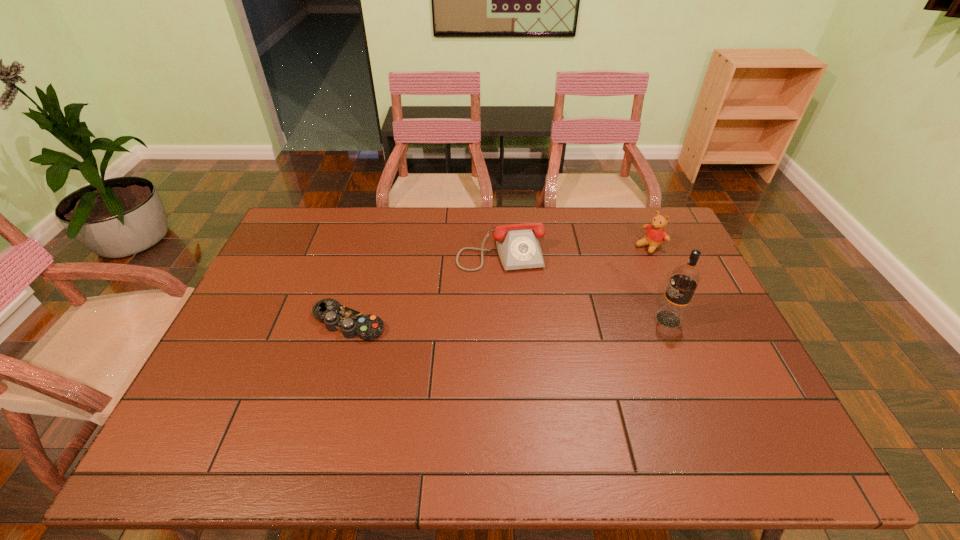
Where is `unoccupied position between the telephone and the third shortest object`? unoccupied position between the telephone and the third shortest object is located at coordinates (575, 247).

This screenshot has width=960, height=540. Find the location of `free space between the tallest object and the third shortest object`. free space between the tallest object and the third shortest object is located at coordinates (659, 282).

Identify the location of vacant space that's between the leftmost object and the third shortest object. This screenshot has height=540, width=960. (499, 284).

This screenshot has width=960, height=540. Identify the location of unoccupied position between the leftmost object and the third shortest object. (499, 284).

You are a GUI agent. You are given a task and a screenshot of the screen. Output one action in this format:
    pyautogui.click(x=<x>, y=<y>)
    Task: Click on the vacant area that lies between the control and the third shortest object
    
    Given the screenshot: What is the action you would take?
    pyautogui.click(x=499, y=284)

The height and width of the screenshot is (540, 960). Find the location of `free space between the vodka and the second shortest object`. free space between the vodka and the second shortest object is located at coordinates (585, 284).

Locate an element on the screen. Image resolution: width=960 pixels, height=540 pixels. object that stands as the second closest to the third object from right to left is located at coordinates (655, 235).

Locate an element on the screen. object that ranks as the second closest to the vodka is located at coordinates (518, 247).

Where is `vacant position in the image that satisfies the following two spatial constraints: 1. on the back side of the control; 2. on the label of the vodka`? The height and width of the screenshot is (540, 960). vacant position in the image that satisfies the following two spatial constraints: 1. on the back side of the control; 2. on the label of the vodka is located at coordinates [x=349, y=319].

Where is `free space that satisfies the following two spatial constraints: 1. on the front side of the vodka; 2. on the label of the third tallest object`? This screenshot has height=540, width=960. free space that satisfies the following two spatial constraints: 1. on the front side of the vodka; 2. on the label of the third tallest object is located at coordinates [504, 319].